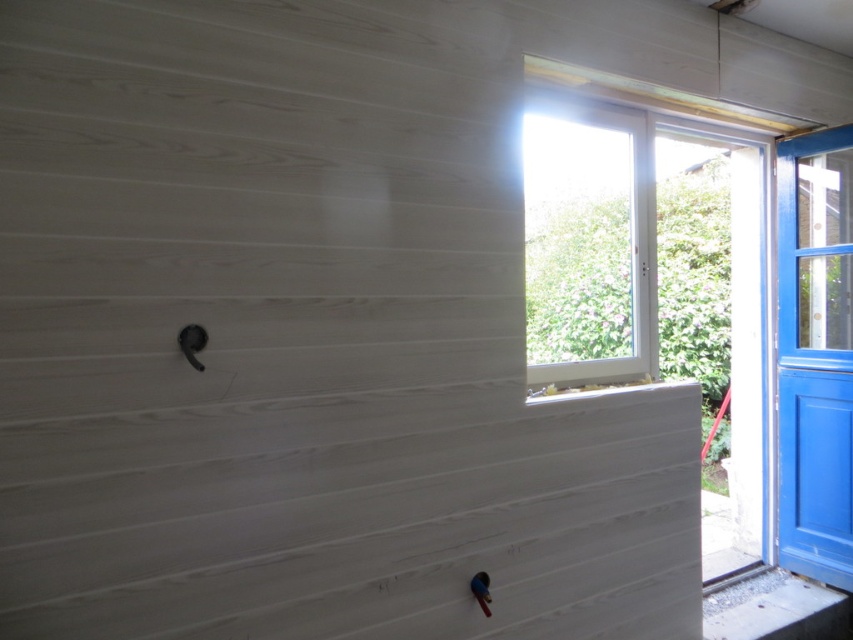
Question: Does white plastic window at upper center have a larger size compared to blue glossy door at right?

Choices:
 (A) no
 (B) yes

Answer: (B)

Question: Where is white plastic window at upper center located in relation to smooth concrete window sill at lower right in the image?

Choices:
 (A) above
 (B) below

Answer: (A)

Question: Which of these objects is positioned closest to the smooth concrete window sill at lower right?

Choices:
 (A) white plastic window at upper center
 (B) blue glossy door at right

Answer: (B)

Question: Which is nearer to the white plastic window at upper center?

Choices:
 (A) blue glossy door at right
 (B) smooth concrete window sill at lower right

Answer: (A)

Question: Is blue glossy door at right smaller than smooth concrete window sill at lower right?

Choices:
 (A) no
 (B) yes

Answer: (A)

Question: Among these points, which one is nearest to the camera?

Choices:
 (A) (795, 384)
 (B) (596, 332)

Answer: (A)